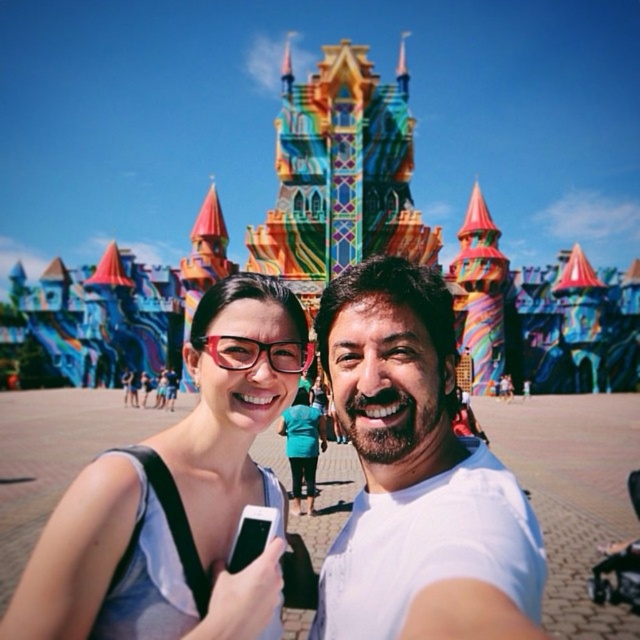
What do you see at coordinates (340, 173) in the screenshot? The height and width of the screenshot is (640, 640). I see `multicolored painted castle at center` at bounding box center [340, 173].

Between point (337, 179) and point (124, 394), which one is positioned behind?

The point (124, 394) is behind.

Locate an element on the screen. multicolored painted castle at center is located at coordinates (340, 173).

Can you confirm if multicolored painted castle at center is shorter than matte white tank top at center?

In fact, multicolored painted castle at center may be taller than matte white tank top at center.

Describe the element at coordinates (340, 173) in the screenshot. The width and height of the screenshot is (640, 640). I see `multicolored painted castle at center` at that location.

Is point (403, 49) positioned in front of point (216, 413)?

That is False.

This screenshot has height=640, width=640. What are the coordinates of `multicolored painted castle at center` in the screenshot? It's located at (340, 173).

Does multicolored painted castle at center have a greater height compared to white matte shirt at center?

Yes, multicolored painted castle at center is taller than white matte shirt at center.

Is multicolored painted castle at center positioned in front of white matte shirt at center?

No, multicolored painted castle at center is behind white matte shirt at center.

Where is `multicolored painted castle at center`? multicolored painted castle at center is located at coordinates click(340, 173).